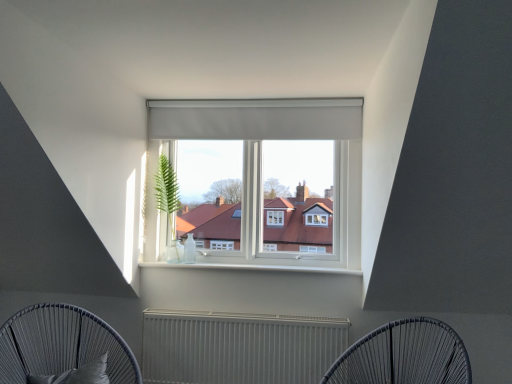
This screenshot has height=384, width=512. Identify the location of green leafy plant at center. (167, 190).

Measure the distance between point [169,209] and camera.

They are 3.23 meters apart.

The height and width of the screenshot is (384, 512). Describe the element at coordinates (77, 374) in the screenshot. I see `black fabric pillow at lower left` at that location.

This screenshot has width=512, height=384. Find the location of `black fabric pillow at lower left`. black fabric pillow at lower left is located at coordinates (77, 374).

Measure the distance between point (113, 371) and camera.

2.35 meters.

Locate an element on the screen. The height and width of the screenshot is (384, 512). dark grey woven chair at lower left, which appears as the second furniture when viewed from the right is located at coordinates [x=61, y=344].

I want to click on metallic wire chair at lower center, which is the 1th furniture in right-to-left order, so click(404, 356).

Find the location of a particular element. The height and width of the screenshot is (384, 512). plant above the metallic radiator at center (from a real-world perspective) is located at coordinates (167, 190).

How distant is metallic radiator at center from green leafy plant at center?

37.54 inches.

Looking at this image, is the position of metallic radiator at center more distant than that of green leafy plant at center?

No.

Are metallic radiator at center and green leafy plant at center located far from each other?

They are positioned close to each other.

Which is correct: metallic radiator at center is inside matte gray curtain at center, or outside of it?

metallic radiator at center is not enclosed by matte gray curtain at center.

Considering the sizes of objects metallic radiator at center and matte gray curtain at center in the image provided, who is shorter, metallic radiator at center or matte gray curtain at center?

Standing shorter between the two is matte gray curtain at center.

How far apart are metallic radiator at center and matte gray curtain at center?

The distance of metallic radiator at center from matte gray curtain at center is 1.43 meters.

Looking at their sizes, would you say metallic radiator at center is wider or thinner than matte gray curtain at center?

Clearly, metallic radiator at center has more width compared to matte gray curtain at center.

What's the angular difference between black fabric pillow at lower left and dark grey woven chair at lower left, which appears as the second furniture when viewed from the right,'s facing directions?

black fabric pillow at lower left and dark grey woven chair at lower left, which appears as the second furniture when viewed from the right, are facing 11.2 degrees away from each other.

Considering the positions of objects black fabric pillow at lower left and dark grey woven chair at lower left, which appears as the second furniture when viewed from the right, in the image provided, who is more to the left, black fabric pillow at lower left or dark grey woven chair at lower left, which appears as the second furniture when viewed from the right,?

dark grey woven chair at lower left, which appears as the second furniture when viewed from the right.

Is dark grey woven chair at lower left, which appears as the second furniture when viewed from the right, surrounded by black fabric pillow at lower left?

No, dark grey woven chair at lower left, which appears as the second furniture when viewed from the right, is located outside of black fabric pillow at lower left.

From a real-world perspective, does black fabric pillow at lower left stand above dark grey woven chair at lower left, which appears as the second furniture when viewed from the right?

No.

From their relative heights in the image, would you say black fabric pillow at lower left is taller or shorter than green leafy plant at center?

Considering their sizes, black fabric pillow at lower left has less height than green leafy plant at center.

From a real-world perspective, is black fabric pillow at lower left above or below green leafy plant at center?

From a real-world perspective, black fabric pillow at lower left is physically below green leafy plant at center.

Measure the distance between black fabric pillow at lower left and green leafy plant at center.

black fabric pillow at lower left and green leafy plant at center are 3.99 feet apart from each other.

Is there a large distance between black fabric pillow at lower left and green leafy plant at center?

Yes.

From a real-world perspective, is green leafy plant at center positioned over metallic wire chair at lower center, placed as the second furniture when sorted from left to right, based on gravity?

Correct, in the physical world, green leafy plant at center is higher than metallic wire chair at lower center, placed as the second furniture when sorted from left to right.

The image size is (512, 384). I want to click on plant above the metallic wire chair at lower center, placed as the second furniture when sorted from left to right (from the image's perspective), so click(x=167, y=190).

Can metallic wire chair at lower center, placed as the second furniture when sorted from left to right, be found inside green leafy plant at center?

No.

Can you confirm if green leafy plant at center is thinner than metallic wire chair at lower center, placed as the second furniture when sorted from left to right?

Indeed, green leafy plant at center has a lesser width compared to metallic wire chair at lower center, placed as the second furniture when sorted from left to right.

Considering the sizes of objects metallic wire chair at lower center, placed as the second furniture when sorted from left to right, and green leafy plant at center in the image provided, who is shorter, metallic wire chair at lower center, placed as the second furniture when sorted from left to right, or green leafy plant at center?

metallic wire chair at lower center, placed as the second furniture when sorted from left to right, is shorter.

From the picture: Considering the positions of objects metallic wire chair at lower center, placed as the second furniture when sorted from left to right, and green leafy plant at center in the image provided, who is more to the right, metallic wire chair at lower center, placed as the second furniture when sorted from left to right, or green leafy plant at center?

metallic wire chair at lower center, placed as the second furniture when sorted from left to right.

Which of these two, metallic wire chair at lower center, which is the 1th furniture in right-to-left order, or green leafy plant at center, is smaller?

green leafy plant at center.

Looking at this image, could you tell me if metallic radiator at center is facing dark grey woven chair at lower left, which ranks as the first furniture in left-to-right order?

Yes, metallic radiator at center faces towards dark grey woven chair at lower left, which ranks as the first furniture in left-to-right order.

Between point (297, 323) and point (110, 334), which one is positioned behind?

The point (297, 323) is farther from the camera.

Consider the image. From a real-world perspective, is metallic radiator at center located higher than dark grey woven chair at lower left, which ranks as the first furniture in left-to-right order?

No, from a real-world perspective, metallic radiator at center is not on top of dark grey woven chair at lower left, which ranks as the first furniture in left-to-right order.

This screenshot has width=512, height=384. Identify the location of plant behind the metallic radiator at center. (167, 190).

Locate an element on the screen. radiator below the matte gray curtain at center (from the image's perspective) is located at coordinates (239, 347).

Consider the image. Which object lies nearer to the anchor point dark grey woven chair at lower left, which ranks as the first furniture in left-to-right order, metallic radiator at center or matte gray curtain at center?

The object closer to dark grey woven chair at lower left, which ranks as the first furniture in left-to-right order, is metallic radiator at center.

Which object lies further to the anchor point metallic radiator at center, matte gray curtain at center or dark grey woven chair at lower left, which ranks as the first furniture in left-to-right order?

matte gray curtain at center.

Considering their positions, is metallic wire chair at lower center, which is the 1th furniture in right-to-left order, positioned further to metallic radiator at center than black fabric pillow at lower left?

The object further to metallic radiator at center is black fabric pillow at lower left.

Based on their spatial positions, is metallic radiator at center or dark grey woven chair at lower left, which ranks as the first furniture in left-to-right order, closer to metallic wire chair at lower center, which is the 1th furniture in right-to-left order?

The object closer to metallic wire chair at lower center, which is the 1th furniture in right-to-left order, is metallic radiator at center.

Based on their spatial positions, is dark grey woven chair at lower left, which ranks as the first furniture in left-to-right order, or metallic radiator at center closer to black fabric pillow at lower left?

The object closer to black fabric pillow at lower left is dark grey woven chair at lower left, which ranks as the first furniture in left-to-right order.

When comparing their distances from dark grey woven chair at lower left, which appears as the second furniture when viewed from the right, does green leafy plant at center or metallic wire chair at lower center, which is the 1th furniture in right-to-left order, seem closer?

green leafy plant at center is closer to dark grey woven chair at lower left, which appears as the second furniture when viewed from the right.

Which object lies nearer to the anchor point black fabric pillow at lower left, matte gray curtain at center or metallic radiator at center?

metallic radiator at center.

Which object lies further to the anchor point dark grey woven chair at lower left, which ranks as the first furniture in left-to-right order, black fabric pillow at lower left or matte gray curtain at center?

Based on the image, matte gray curtain at center appears to be further to dark grey woven chair at lower left, which ranks as the first furniture in left-to-right order.

Identify the location of pillow between dark grey woven chair at lower left, which appears as the second furniture when viewed from the right, and metallic wire chair at lower center, which is the 1th furniture in right-to-left order, in the horizontal direction. (77, 374).

Identify the location of pillow between dark grey woven chair at lower left, which appears as the second furniture when viewed from the right, and metallic radiator at center, along the z-axis. The width and height of the screenshot is (512, 384). (77, 374).

I want to click on plant between matte gray curtain at center and black fabric pillow at lower left in the vertical direction, so click(x=167, y=190).

Where is `radiator between dark grey woven chair at lower left, which ranks as the first furniture in left-to-right order, and green leafy plant at center in the front-back direction`? radiator between dark grey woven chair at lower left, which ranks as the first furniture in left-to-right order, and green leafy plant at center in the front-back direction is located at coordinates (239, 347).